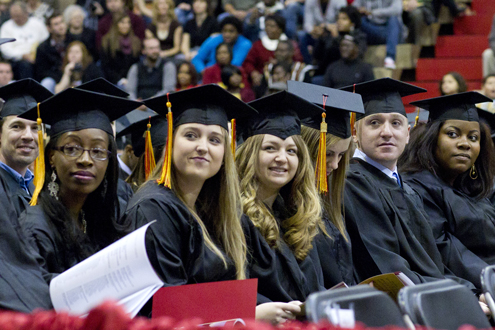
Identify the location of papers. (124, 268), (131, 307).